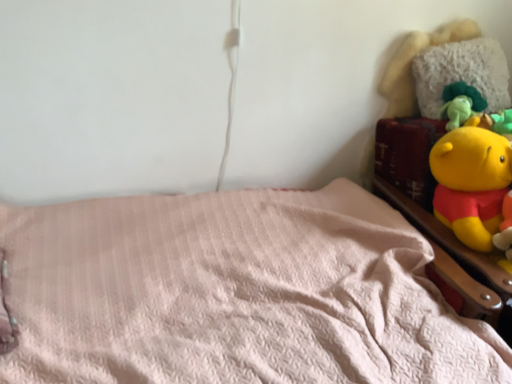
What do you see at coordinates (234, 293) in the screenshot? I see `pink fluffy blanket at lower left` at bounding box center [234, 293].

What are the coordinates of `wooden bed frame at upper right` in the screenshot? It's located at (455, 262).

This screenshot has height=384, width=512. Identify the location of bed lying below the wooden bed frame at upper right (from the image's perspective). (234, 293).

Is wooden bed frame at upper right not near pink fluffy blanket at lower left?

That's not correct — wooden bed frame at upper right is a little close to pink fluffy blanket at lower left.

Between point (393, 191) and point (81, 374), which one is positioned behind?

Positioned behind is point (393, 191).

Which of these two, wooden bed frame at upper right or pink fluffy blanket at lower left, stands taller?

Standing taller between the two is pink fluffy blanket at lower left.

From the image's perspective, who appears lower, wooden bed frame at upper right or fluffy white pillow at upper right?

From the image's view, wooden bed frame at upper right is below.

The image size is (512, 384). I want to click on pillow that is above the wooden bed frame at upper right (from a real-world perspective), so click(x=461, y=73).

Based on their sizes in the image, would you say wooden bed frame at upper right is bigger or smaller than fluffy white pillow at upper right?

wooden bed frame at upper right is bigger than fluffy white pillow at upper right.

From the image's perspective, is fluffy white pillow at upper right positioned above or below pink fluffy blanket at lower left?

Based on their image positions, fluffy white pillow at upper right is located above pink fluffy blanket at lower left.

Is fluffy white pillow at upper right wider or thinner than pink fluffy blanket at lower left?

In the image, fluffy white pillow at upper right appears to be more narrow than pink fluffy blanket at lower left.

This screenshot has height=384, width=512. Identify the location of bed lying on the left of fluffy white pillow at upper right. (234, 293).

In the scene shown: From a real-world perspective, is pink fluffy blanket at lower left positioned under wooden bed frame at upper right based on gravity?

Yes, from a real-world perspective, pink fluffy blanket at lower left is under wooden bed frame at upper right.

Is pink fluffy blanket at lower left facing away from wooden bed frame at upper right?

pink fluffy blanket at lower left does not have its back to wooden bed frame at upper right.

From the image's perspective, between pink fluffy blanket at lower left and wooden bed frame at upper right, who is located below?

pink fluffy blanket at lower left appears lower in the image.

Would you say fluffy white pillow at upper right is to the left or to the right of wooden bed frame at upper right in the picture?

Based on their positions, fluffy white pillow at upper right is located to the left of wooden bed frame at upper right.

The image size is (512, 384). There is a wooden bed frame at upper right. Identify the location of pillow above it (from a real-world perspective). (461, 73).

Is fluffy white pillow at upper right not close to wooden bed frame at upper right?

No, fluffy white pillow at upper right is not far away from wooden bed frame at upper right.

Between fluffy white pillow at upper right and wooden bed frame at upper right, which one has larger width?

wooden bed frame at upper right is wider.

Considering the relative sizes of pink fluffy blanket at lower left and fluffy white pillow at upper right in the image provided, is pink fluffy blanket at lower left smaller than fluffy white pillow at upper right?

No.

Does pink fluffy blanket at lower left have a greater width compared to fluffy white pillow at upper right?

Yes, pink fluffy blanket at lower left is wider than fluffy white pillow at upper right.

Is pink fluffy blanket at lower left facing away from fluffy white pillow at upper right?

No, fluffy white pillow at upper right is not at the back of pink fluffy blanket at lower left.

Identify the location of bed frame above the pink fluffy blanket at lower left (from the image's perspective). Image resolution: width=512 pixels, height=384 pixels. (455, 262).

The image size is (512, 384). I want to click on bed frame below the fluffy white pillow at upper right (from the image's perspective), so click(455, 262).

Which object lies further to the anchor point pink fluffy blanket at lower left, fluffy white pillow at upper right or wooden bed frame at upper right?

fluffy white pillow at upper right lies further to pink fluffy blanket at lower left than the other object.

Considering their positions, is wooden bed frame at upper right positioned further to fluffy white pillow at upper right than pink fluffy blanket at lower left?

pink fluffy blanket at lower left lies further to fluffy white pillow at upper right than the other object.

When comparing their distances from pink fluffy blanket at lower left, does wooden bed frame at upper right or fluffy white pillow at upper right seem further?

fluffy white pillow at upper right is positioned further to the anchor pink fluffy blanket at lower left.

When comparing their distances from fluffy white pillow at upper right, does pink fluffy blanket at lower left or wooden bed frame at upper right seem closer?

wooden bed frame at upper right.

Considering their positions, is fluffy white pillow at upper right positioned closer to wooden bed frame at upper right than pink fluffy blanket at lower left?

pink fluffy blanket at lower left lies closer to wooden bed frame at upper right than the other object.

When comparing their distances from wooden bed frame at upper right, does pink fluffy blanket at lower left or fluffy white pillow at upper right seem closer?

Among the two, pink fluffy blanket at lower left is located nearer to wooden bed frame at upper right.

Find the location of a particular element. pillow between pink fluffy blanket at lower left and wooden bed frame at upper right is located at coordinates (461, 73).